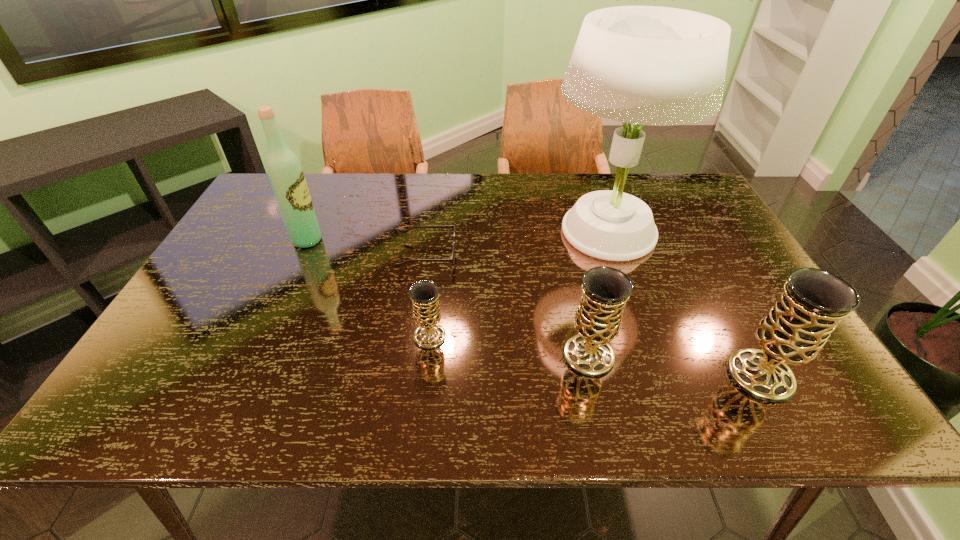
Where is `free space that satisfies the following two spatial constraints: 1. on the front-facing side of the tallest object; 2. on the back side of the rightmost chalice`? The image size is (960, 540). free space that satisfies the following two spatial constraints: 1. on the front-facing side of the tallest object; 2. on the back side of the rightmost chalice is located at coordinates (657, 376).

The height and width of the screenshot is (540, 960). I want to click on vacant region that satisfies the following two spatial constraints: 1. on the front-facing side of the leftmost object; 2. on the right side of the rightmost chalice, so click(245, 376).

At what (x,y) coordinates should I click in order to perform the action: click on free space that satisfies the following two spatial constraints: 1. on the front-facing side of the second tallest object; 2. on the left side of the leftmost chalice. Please return your answer as a coordinate pair (x, y). Looking at the image, I should click on (263, 336).

Where is `free space that satisfies the following two spatial constraints: 1. on the front-facing side of the leftmost object; 2. on the back side of the leftmost chalice`? The width and height of the screenshot is (960, 540). free space that satisfies the following two spatial constraints: 1. on the front-facing side of the leftmost object; 2. on the back side of the leftmost chalice is located at coordinates (263, 336).

Locate an element on the screen. This screenshot has height=540, width=960. vacant point that satisfies the following two spatial constraints: 1. on the front-facing side of the leftmost object; 2. on the back side of the fourth tallest object is located at coordinates (254, 355).

Locate an element on the screen. This screenshot has height=540, width=960. vacant space that satisfies the following two spatial constraints: 1. on the front lenses of the shortest object; 2. on the right side of the shortest chalice is located at coordinates (417, 336).

I want to click on free region that satisfies the following two spatial constraints: 1. on the front lenses of the rightmost chalice; 2. on the right side of the sunglasses, so click(411, 376).

At what (x,y) coordinates should I click in order to perform the action: click on vacant space that satisfies the following two spatial constraints: 1. on the front lenses of the second tallest chalice; 2. on the right side of the sunglasses. Please return your answer as a coordinate pair (x, y). Looking at the image, I should click on (414, 355).